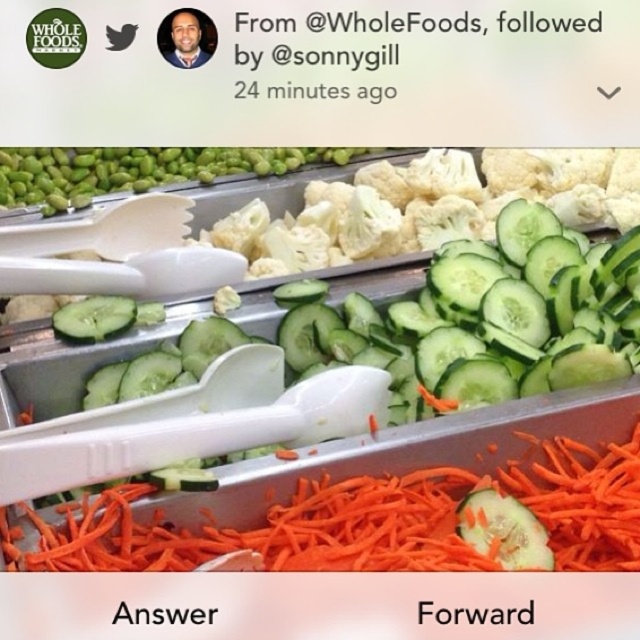
Question: Which object appears closest to the camera in this image?

Choices:
 (A) green matte cucumber at center
 (B) orange shredded carrot at lower center

Answer: (A)

Question: Is green matte cucumber at center closer to the viewer compared to orange shredded carrot at lower center?

Choices:
 (A) no
 (B) yes

Answer: (B)

Question: Is green matte cucumber at center smaller than green matte edamame at upper left?

Choices:
 (A) no
 (B) yes

Answer: (A)

Question: Which of the following is the farthest from the observer?

Choices:
 (A) (148, 468)
 (B) (84, 192)

Answer: (B)

Question: Which point is closer to the camera?

Choices:
 (A) click(20, 204)
 (B) click(445, 348)
 (C) click(364, 492)

Answer: (C)

Question: Is orange shredded carrot at lower center below green matte edamame at upper left?

Choices:
 (A) yes
 (B) no

Answer: (A)